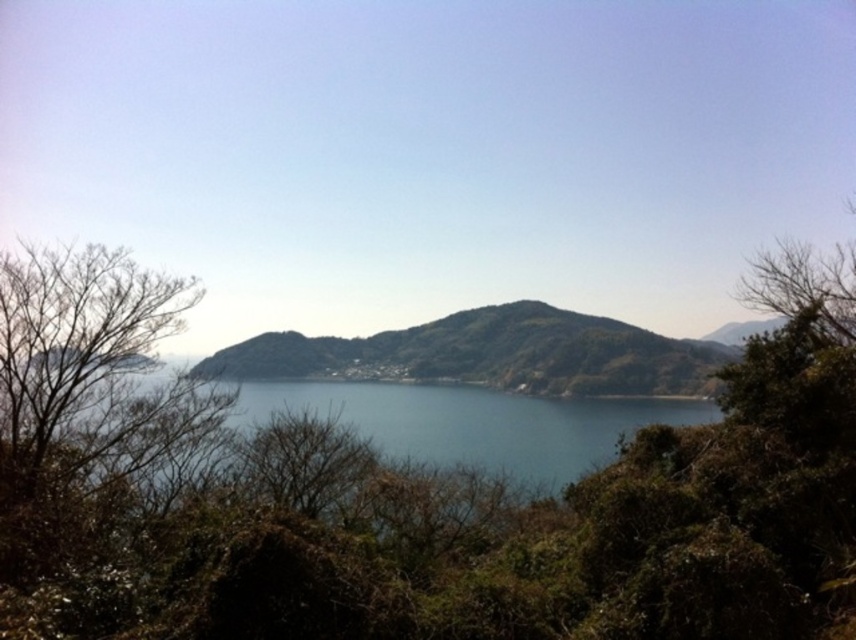
Does green leafy tree at center have a lesser width compared to blue water at center?

Correct, green leafy tree at center's width is less than blue water at center's.

From the picture: Is green leafy tree at center bigger than blue water at center?

No, green leafy tree at center is not bigger than blue water at center.

The image size is (856, 640). Describe the element at coordinates (432, 518) in the screenshot. I see `green leafy tree at center` at that location.

I want to click on green leafy tree at center, so click(432, 518).

Is point (521, 380) in front of point (483, 392)?

Yes, it is.

Who is positioned more to the left, green grassy hill at center or blue water at center?

From the viewer's perspective, blue water at center appears more on the left side.

Between point (629, 394) and point (702, 412), which one is positioned behind?

The point (629, 394) is behind.

Where is `green grassy hill at center`? This screenshot has height=640, width=856. green grassy hill at center is located at coordinates tap(491, 355).

Is green leafy tree at center positioned before green grassy hill at center?

Yes, green leafy tree at center is closer to the viewer.

Who is higher up, green leafy tree at center or green grassy hill at center?

Positioned higher is green leafy tree at center.

Which is behind, point (80, 637) or point (635, 326)?

Positioned behind is point (635, 326).

Where is `green leafy tree at center`? The height and width of the screenshot is (640, 856). green leafy tree at center is located at coordinates (432, 518).